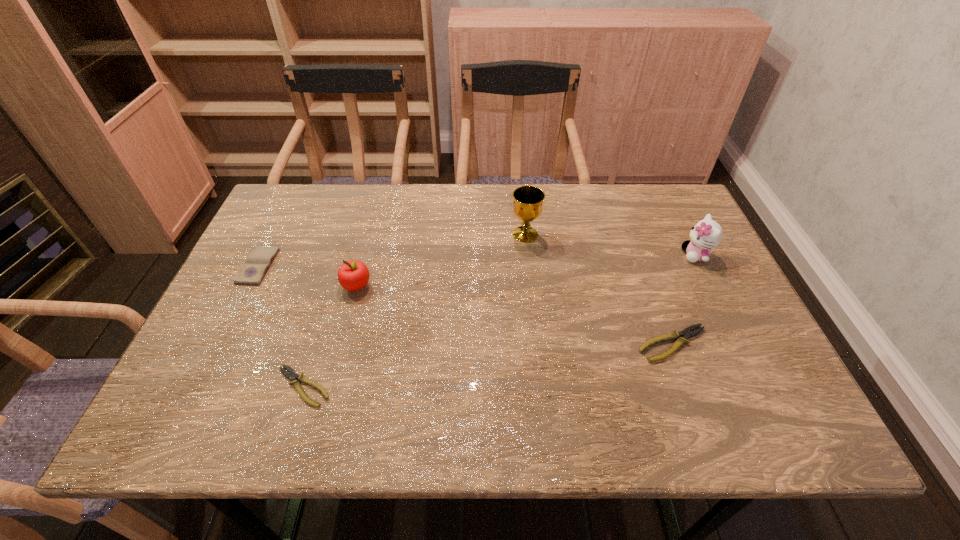
Find the location of a particular element. pliers that is at the right edge is located at coordinates (687, 333).

Where is `kitten that is at the right edge`? The height and width of the screenshot is (540, 960). kitten that is at the right edge is located at coordinates [x=706, y=234].

The image size is (960, 540). Find the location of `object present at the near right corner`. object present at the near right corner is located at coordinates (687, 333).

In the image, there is a desktop. Where is `vacant space at the far edge`? vacant space at the far edge is located at coordinates coord(413,215).

Identify the location of vacant space at the near edge of the desktop. tap(550, 392).

This screenshot has width=960, height=540. I want to click on vacant space at the left edge of the desktop, so click(x=284, y=262).

The height and width of the screenshot is (540, 960). In the image, there is a desktop. Find the location of `vacant space at the right edge`. vacant space at the right edge is located at coordinates (730, 323).

In the image, there is a desktop. Identify the location of free space at the far left corner. Image resolution: width=960 pixels, height=540 pixels. (302, 224).

The image size is (960, 540). Identify the location of vacant space at the near left corner. (257, 363).

In the image, there is a desktop. Where is `free space at the far right corner`? The height and width of the screenshot is (540, 960). free space at the far right corner is located at coordinates (685, 219).